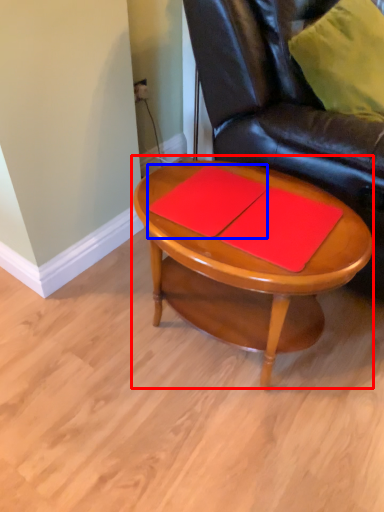
Question: Which of the following is the closest to the observer, coffee table (highlighted by a red box) or notebook (highlighted by a blue box)?

Choices:
 (A) coffee table
 (B) notebook

Answer: (A)